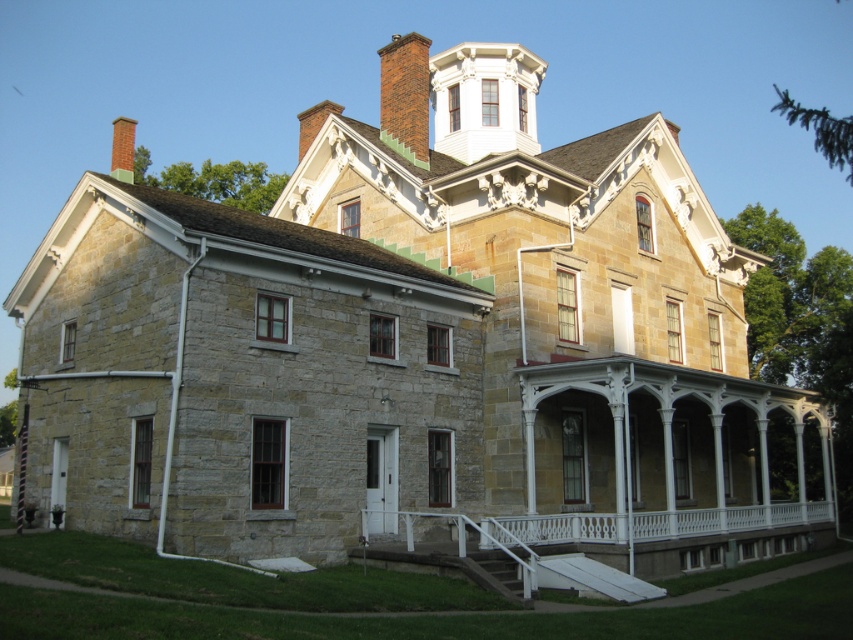
You are standing in front of the historic stone house and want to locate the white painted wood porch at lower center and the red brick chimney at upper center. According to their positions, which object is closer to the right side of the house?

The white painted wood porch at lower center is to the right of the red brick chimney at upper center, so the white painted wood porch at lower center is closer to the right side of the house.

You are standing at the base of the historic stone house. You want to place a decorative statue exactly at the point marked as point (x=387, y=100) on the house facade. If you have a statue that is 2 meters tall, will it be visible from your current position? Explain your reasoning.

The point (x=387, y=100) is 63.41 meters away from the viewer. Since the statue is only 2 meters tall, it may not be easily visible from that distance due to the small size relative to the distance. However, if the statue is placed at that point, it would still be visible as long as there are no obstructions between the viewer and the point.

You are a painter who needs to decide which object to paint first. Considering their sizes, which object should you tackle first, the white painted wood porch at lower center or the red brick chimney at upper center?

The red brick chimney at upper center is larger than the white painted wood porch at lower center, so you should tackle the red brick chimney at upper center first.